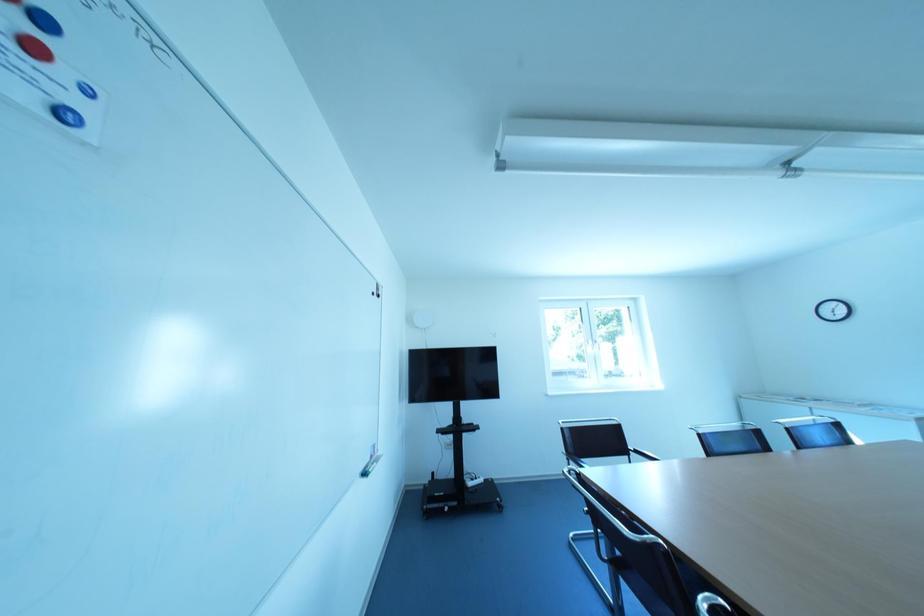
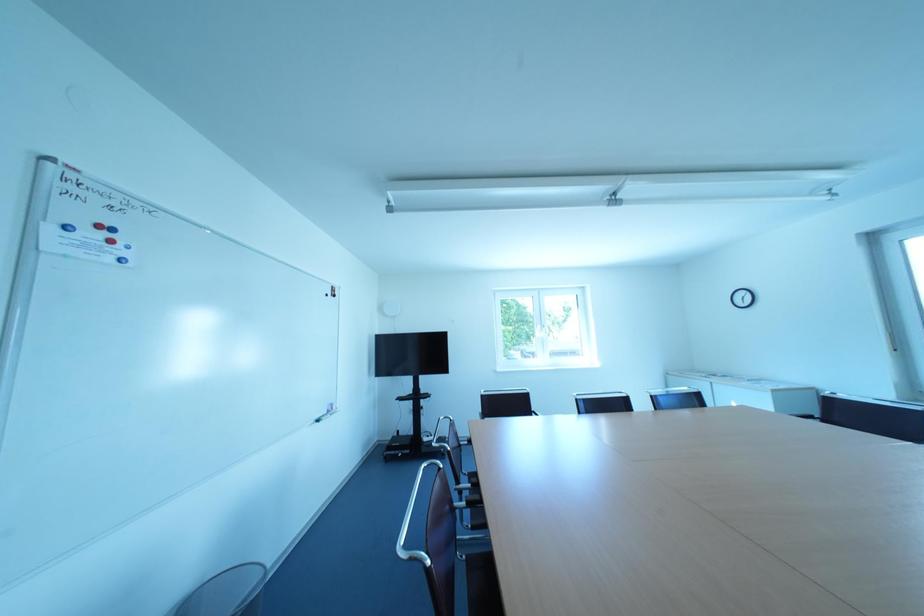
In a continuous first-person perspective shot, in which direction is the camera moving?

The cameraman moved toward right, backward.